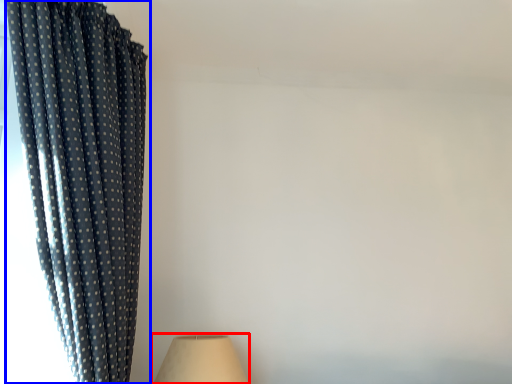
Question: Which point is closer to the camera, lamp (highlighted by a red box) or curtain (highlighted by a blue box)?

Choices:
 (A) lamp
 (B) curtain

Answer: (B)